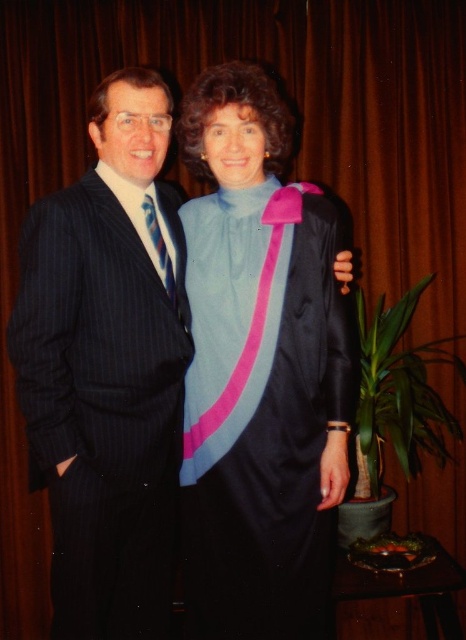
Question: Which point is farther to the camera?

Choices:
 (A) satin blue dress at center
 (B) pinstriped suit at left

Answer: (A)

Question: Which point is closer to the camera taking this photo?

Choices:
 (A) (171, 285)
 (B) (47, 202)
 (C) (199, 513)

Answer: (B)

Question: Does satin blue dress at center appear on the left side of striped silk tie at left?

Choices:
 (A) yes
 (B) no

Answer: (B)

Question: Which object is farther from the camera taking this photo?

Choices:
 (A) pinstriped suit at left
 (B) striped silk tie at left

Answer: (B)

Question: Is satin blue dress at center thinner than striped silk tie at left?

Choices:
 (A) yes
 (B) no

Answer: (B)

Question: Is pinstriped suit at left above striped silk tie at left?

Choices:
 (A) no
 (B) yes

Answer: (A)